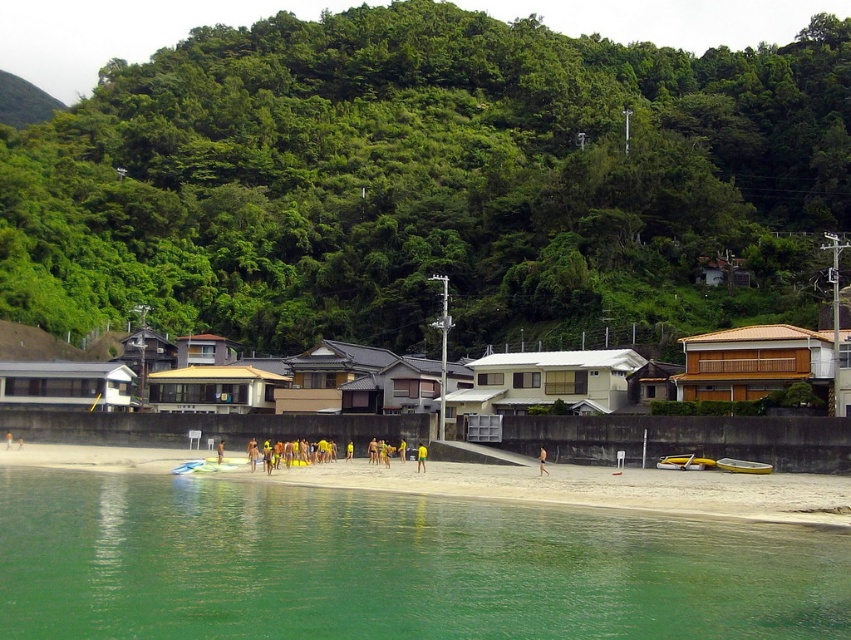
Is green translucent water at lower left to the left of yellow fabric person at center from the viewer's perspective?

Yes, green translucent water at lower left is to the left of yellow fabric person at center.

Between green translucent water at lower left and yellow fabric person at center, which one appears on the left side from the viewer's perspective?

Positioned to the left is green translucent water at lower left.

Which is behind, point (332, 540) or point (417, 460)?

Positioned behind is point (417, 460).

The height and width of the screenshot is (640, 851). In order to click on green translucent water at lower left in this screenshot , I will do `click(392, 564)`.

From the picture: Is green translucent water at lower left positioned at the back of tan skin person at center?

No.

Is point (838, 593) more distant than point (540, 461)?

No, it is in front of (540, 461).

In order to click on green translucent water at lower left in this screenshot , I will do `click(392, 564)`.

Can you confirm if white sand beach at lower center is positioned to the left of tan skin person at center?

Indeed, white sand beach at lower center is positioned on the left side of tan skin person at center.

Which is more to the right, white sand beach at lower center or tan skin person at center?

tan skin person at center is more to the right.

Find the location of `white sand beach at lower center`. white sand beach at lower center is located at coordinates [592, 486].

Identify the location of white sand beach at lower center. This screenshot has width=851, height=640. (592, 486).